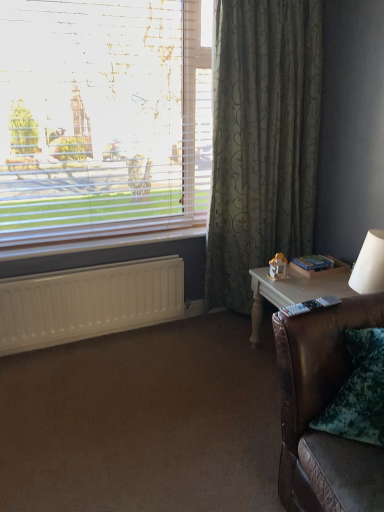
What is the approximate height of white plastic radiator at lower left?

white plastic radiator at lower left is 1.90 inches tall.

Where is `brown leather couch at lower right`? The height and width of the screenshot is (512, 384). brown leather couch at lower right is located at coordinates (322, 410).

This screenshot has width=384, height=512. What do you see at coordinates (322, 410) in the screenshot? I see `brown leather couch at lower right` at bounding box center [322, 410].

The image size is (384, 512). Describe the element at coordinates (102, 119) in the screenshot. I see `white blinds at upper left` at that location.

Find the location of a particular element. brown leather couch at lower right is located at coordinates (144, 421).

In order to click on white plastic radiator at lower left in this screenshot , I will do `click(101, 243)`.

Considering the sizes of green textured curtain at right and white plastic radiator at lower left in the image, is green textured curtain at right bigger or smaller than white plastic radiator at lower left?

Considering their sizes, green textured curtain at right takes up more space than white plastic radiator at lower left.

Is green textured curtain at right not inside white plastic radiator at lower left?

green textured curtain at right lies outside white plastic radiator at lower left's area.

Does green textured curtain at right appear on the left side of white plastic radiator at lower left?

No.

Is brown leather couch at lower right smaller than white wood table at right?

Yes.

Is point (368, 503) closer to viewer compared to point (343, 285)?

Yes, it is in front of point (343, 285).

Looking at this image, considering the sizes of brown leather couch at lower right and white wood table at right in the image, is brown leather couch at lower right taller or shorter than white wood table at right?

brown leather couch at lower right is taller than white wood table at right.

Locate an element on the screen. studio couch below the white wood table at right (from the image's perspective) is located at coordinates (322, 410).

From the image's perspective, between white wood table at right and green textured curtain at right, which one is located above?

green textured curtain at right.

Is white wood table at right outside of green textured curtain at right?

Yes, white wood table at right is not within green textured curtain at right.

Which of these two, white wood table at right or green textured curtain at right, stands taller?

green textured curtain at right is taller.

Can you confirm if white wood table at right is bigger than green textured curtain at right?

No.

Could white matte radiator at lower left be considered to be inside green textured curtain at right?

No.

Where is `radiator that appears below the green textured curtain at right (from a real-world perspective)`? radiator that appears below the green textured curtain at right (from a real-world perspective) is located at coordinates (89, 302).

Between green textured curtain at right and white matte radiator at lower left, which one has less height?

Standing shorter between the two is white matte radiator at lower left.

Is green textured curtain at right positioned far away from white matte radiator at lower left?

They are positioned close to each other.

From the picture: Is white blinds at upper left positioned in front of white wood table at right?

Yes, it is in front of white wood table at right.

Who is taller, white blinds at upper left or white wood table at right?

white blinds at upper left is taller.

At what (x,y) coordinates should I click in order to perform the action: click on window in front of the white wood table at right. Please return your answer as a coordinate pair (x, y). Image resolution: width=384 pixels, height=512 pixels. Looking at the image, I should click on (102, 119).

Find the location of a particular element. The width and height of the screenshot is (384, 512). window located in front of the white matte radiator at lower left is located at coordinates (102, 119).

From the image's perspective, between white matte radiator at lower left and white blinds at upper left, which one is located above?

white blinds at upper left.

Is white matte radiator at lower left beside white blinds at upper left?

No, white matte radiator at lower left is not with white blinds at upper left.

Consider the image. Is white matte radiator at lower left wider than white blinds at upper left?

No, white matte radiator at lower left is not wider than white blinds at upper left.

Does white plastic radiator at lower left have a larger size compared to white matte radiator at lower left?

No, white plastic radiator at lower left is not bigger than white matte radiator at lower left.

Can you confirm if white plastic radiator at lower left is shorter than white matte radiator at lower left?

Yes.

Locate an element on the screen. This screenshot has height=512, width=384. radiator beneath the white plastic radiator at lower left (from a real-world perspective) is located at coordinates (89, 302).

This screenshot has width=384, height=512. I want to click on curtain above the white plastic radiator at lower left (from the image's perspective), so [x=262, y=141].

Find the location of a particular element. This screenshot has height=512, width=384. table beneath the brown leather couch at lower right (from a real-world perspective) is located at coordinates (295, 289).

Considering their positions, is white plastic radiator at lower left positioned further to brown leather couch at lower right than white wood table at right?

white plastic radiator at lower left.

When comparing their distances from white plastic radiator at lower left, does brown leather couch at lower right or white matte radiator at lower left seem closer?

The object closer to white plastic radiator at lower left is white matte radiator at lower left.

Which object lies further to the anchor point brown leather couch at lower right, white blinds at upper left or white plastic radiator at lower left?

white blinds at upper left lies further to brown leather couch at lower right than the other object.

Based on their spatial positions, is white wood table at right or brown leather couch at lower right closer to white plastic radiator at lower left?

white wood table at right is positioned closer to the anchor white plastic radiator at lower left.

Considering their positions, is white wood table at right positioned closer to brown leather couch at lower right than white plastic radiator at lower left?

white wood table at right is positioned closer to the anchor brown leather couch at lower right.

Considering their positions, is green textured curtain at right positioned further to white plastic radiator at lower left than white wood table at right?

Based on the image, white wood table at right appears to be further to white plastic radiator at lower left.

Looking at this image, which object lies further to the anchor point white wood table at right, green textured curtain at right or brown leather couch at lower right?

brown leather couch at lower right is positioned further to the anchor white wood table at right.

Which object lies further to the anchor point white wood table at right, white plastic radiator at lower left or green textured curtain at right?

white plastic radiator at lower left lies further to white wood table at right than the other object.

Where is `plain situated between white plastic radiator at lower left and white wood table at right from left to right`? plain situated between white plastic radiator at lower left and white wood table at right from left to right is located at coordinates click(144, 421).

Locate an element on the screen. curtain between white plastic radiator at lower left and white wood table at right is located at coordinates (262, 141).

Locate an element on the screen. The image size is (384, 512). window situated between white matte radiator at lower left and white wood table at right from left to right is located at coordinates (102, 119).

Where is `radiator that lies between white blinds at upper left and brown leather couch at lower right from top to bottom`? The width and height of the screenshot is (384, 512). radiator that lies between white blinds at upper left and brown leather couch at lower right from top to bottom is located at coordinates (89, 302).